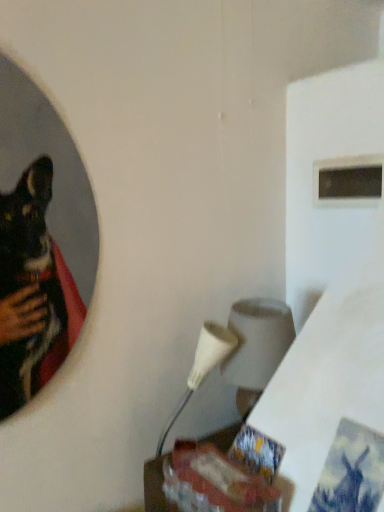
Question: From the image's perspective, is white matte lampshade at center-right positioned above or below wooden table at lower center?

Choices:
 (A) above
 (B) below

Answer: (A)

Question: Considering their positions, is white matte lampshade at center-right located in front of or behind wooden table at lower center?

Choices:
 (A) behind
 (B) front

Answer: (A)

Question: Which of these objects is positioned farthest from the white matte lampshade at center-right?

Choices:
 (A) black glossy mirror at upper left
 (B) black matte window at upper right
 (C) wooden table at lower center

Answer: (B)

Question: Estimate the real-world distances between objects in this image. Which object is farther from the wooden table at lower center?

Choices:
 (A) black glossy mirror at upper left
 (B) black matte window at upper right
 (C) white matte lampshade at center-right

Answer: (B)